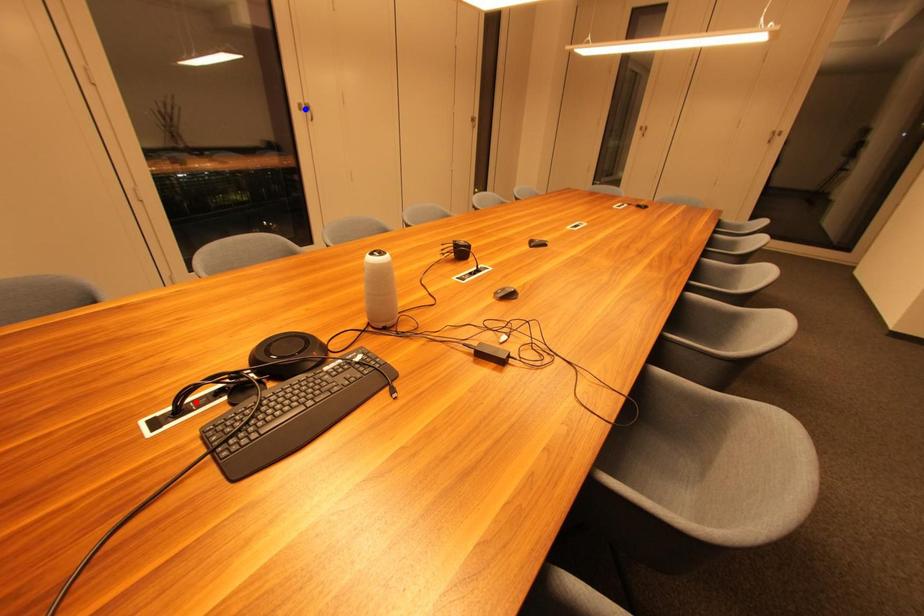
Question: Two points are marked on the image. Which point is closer to the camera?

Choices:
 (A) Blue point is closer.
 (B) Red point is closer.

Answer: (B)